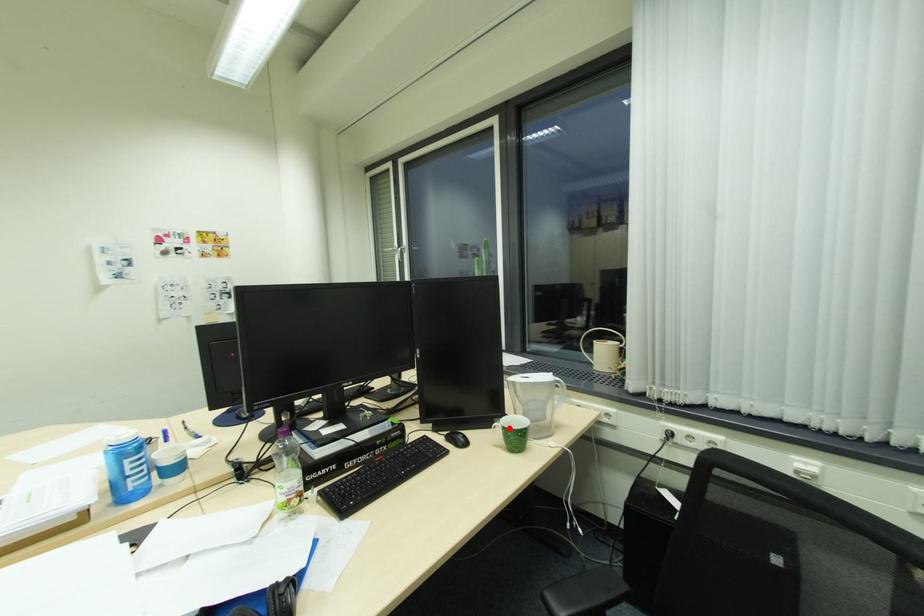
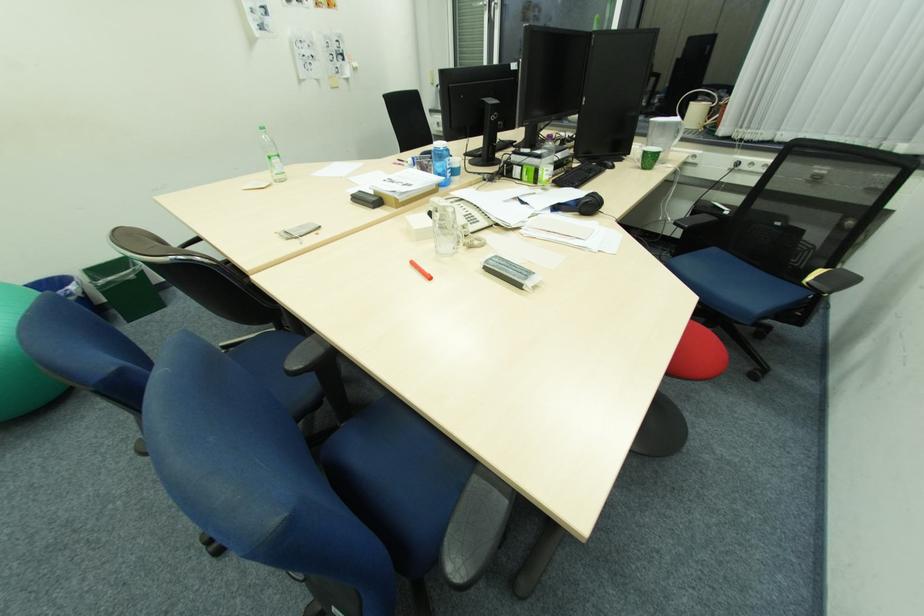
In the second image, find the point that corresponds to the highlighted location in the first image.

(650, 153)